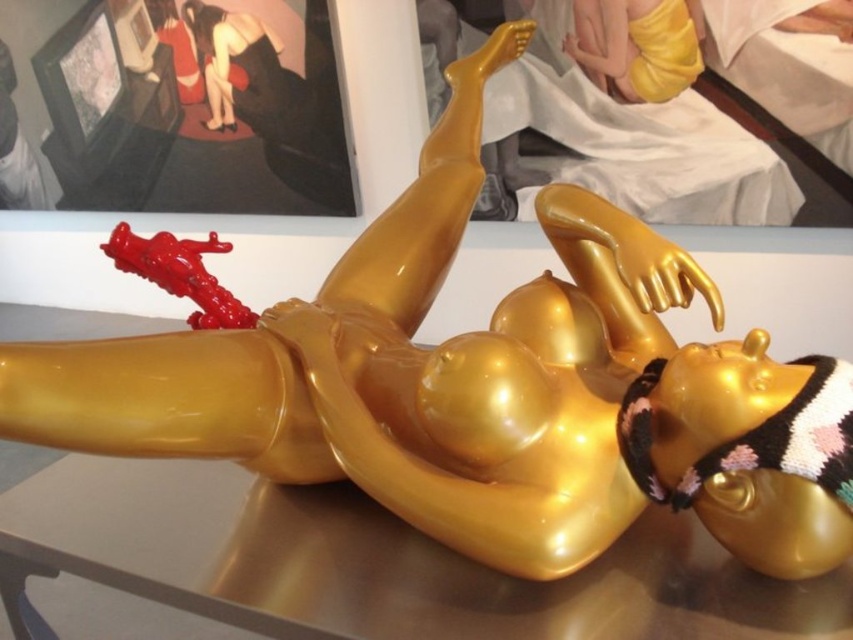
Looking at this image, you are an art curator standing at the entrance of the gallery. You need to place a 36 inch tall sculpture on the transparent glass table at lower center. Will the sculpture fit on the table without exceeding the table height limit?

The transparent glass table at lower center is 37.09 inches away from the camera, but the height of the table is not provided. Therefore, it is impossible to determine if the 36 inch tall sculpture will fit on the table based on the given information.

You are an art curator planning to move the glossy plastic toy at upper left to a different display area. To do this, you need to walk around the transparent glass table at lower center. Can you walk around the table without moving the toy?

The transparent glass table at lower center is in front of the glossy plastic toy at upper left, meaning the table is closer to you. Since the table is in front of the toy, you can walk around the transparent glass table at lower center to access the glossy plastic toy at upper left without moving it.